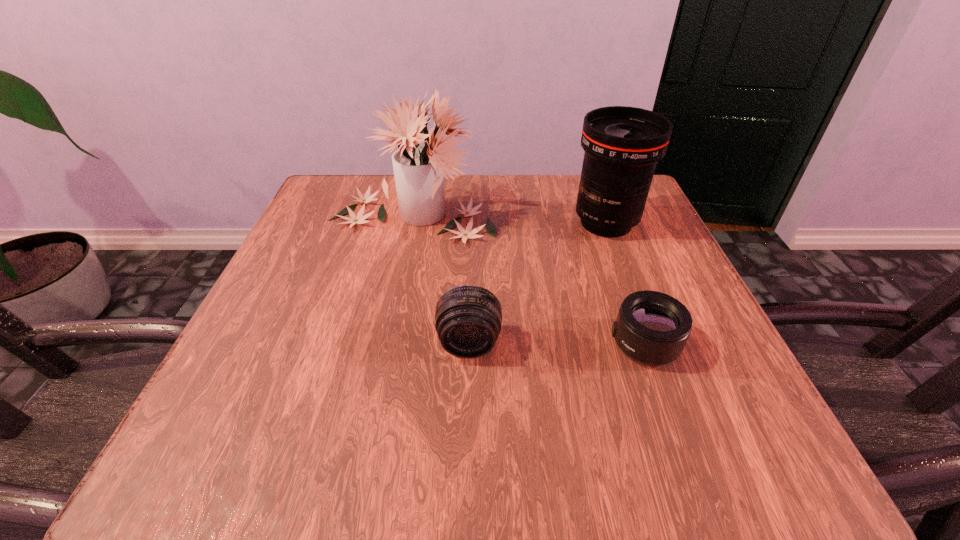
Locate an element on the screen. This screenshot has height=540, width=960. vacant space located 0.240m on the side of the shortest object with brand markings and control switches is located at coordinates (459, 344).

I want to click on free space located 0.090m on the side of the shortest object with brand markings and control switches, so click(x=554, y=344).

Image resolution: width=960 pixels, height=540 pixels. I want to click on bouquet present at the far edge, so click(x=418, y=169).

Locate an element on the screen. This screenshot has width=960, height=540. telephoto lens that is at the far edge is located at coordinates (622, 144).

Where is `object situated at the left edge`? object situated at the left edge is located at coordinates click(x=418, y=169).

At what (x,y) coordinates should I click in order to perform the action: click on object located in the far left corner section of the desktop. Please return your answer as a coordinate pair (x, y). This screenshot has height=540, width=960. Looking at the image, I should click on (418, 169).

At what (x,y) coordinates should I click in order to perform the action: click on object that is at the far right corner. Please return your answer as a coordinate pair (x, y). The width and height of the screenshot is (960, 540). Looking at the image, I should click on (622, 144).

The width and height of the screenshot is (960, 540). Find the location of `vacant space at the far edge of the desktop`. vacant space at the far edge of the desktop is located at coordinates (477, 191).

Identify the location of vacant space at the near edge of the desktop. (615, 420).

You are a GUI agent. You are given a task and a screenshot of the screen. Output one action in this format:
    pyautogui.click(x=<x>, y=<y>)
    Task: Click on the free space at the left edge of the desktop
    
    Given the screenshot: What is the action you would take?
    pyautogui.click(x=339, y=267)